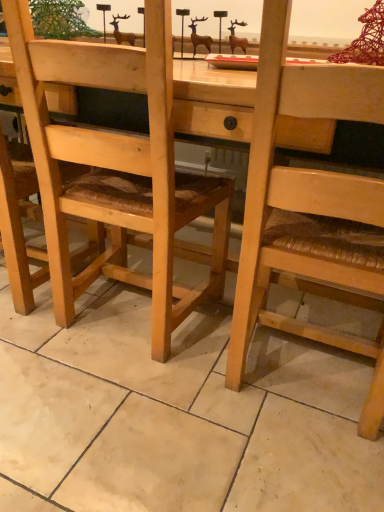
Describe the element at coordinates (308, 206) in the screenshot. The height and width of the screenshot is (512, 384). I see `natural wood chair at center, which is the first chair in right-to-left order` at that location.

Find the location of a particular element. natural wood chair at center, which is the second chair from left to right is located at coordinates (308, 206).

What do you see at coordinates (19, 227) in the screenshot? The image size is (384, 512). I see `wooden woven seat at center, placed as the second chair when sorted from right to left` at bounding box center [19, 227].

In the scene shown: What is the approximate height of wooden woven seat at center, placed as the second chair when sorted from right to left?

The height of wooden woven seat at center, placed as the second chair when sorted from right to left, is 36.45 inches.

Locate an element on the screen. The image size is (384, 512). wooden woven seat at center, which is the first chair from left to right is located at coordinates (19, 227).

The height and width of the screenshot is (512, 384). What are the coordinates of `natural wood chair at center, which is the first chair in right-to-left order` in the screenshot? It's located at (308, 206).

In the scene shown: Based on their positions, is wooden woven seat at center, placed as the second chair when sorted from right to left, located to the left or right of natural wood chair at center, which is the first chair in right-to-left order?

Clearly, wooden woven seat at center, placed as the second chair when sorted from right to left, is on the left of natural wood chair at center, which is the first chair in right-to-left order, in the image.

Is wooden woven seat at center, placed as the second chair when sorted from right to left, in front of natural wood chair at center, which is the second chair from left to right?

No, it is not.

Is point (92, 237) closer or farther from the camera than point (356, 211)?

Clearly, point (92, 237) is more distant from the camera than point (356, 211).

Looking at this image, from the image's perspective, which one is positioned higher, wooden woven seat at center, placed as the second chair when sorted from right to left, or natural wood chair at center, which is the first chair in right-to-left order?

From the image's view, wooden woven seat at center, placed as the second chair when sorted from right to left, is above.

From a real-world perspective, which is physically below, wooden woven seat at center, placed as the second chair when sorted from right to left, or natural wood chair at center, which is the first chair in right-to-left order?

In real-world perspective, wooden woven seat at center, placed as the second chair when sorted from right to left, is lower.

Is wooden woven seat at center, placed as the second chair when sorted from right to left, wider than natural wood chair at center, which is the second chair from left to right?

No, wooden woven seat at center, placed as the second chair when sorted from right to left, is not wider than natural wood chair at center, which is the second chair from left to right.

Considering the sizes of wooden woven seat at center, which is the first chair from left to right, and natural wood chair at center, which is the second chair from left to right, in the image, is wooden woven seat at center, which is the first chair from left to right, taller or shorter than natural wood chair at center, which is the second chair from left to right,?

In the image, wooden woven seat at center, which is the first chair from left to right, appears to be shorter than natural wood chair at center, which is the second chair from left to right.

Who is smaller, wooden woven seat at center, placed as the second chair when sorted from right to left, or natural wood chair at center, which is the first chair in right-to-left order?

wooden woven seat at center, placed as the second chair when sorted from right to left.

Consider the image. Would you say wooden woven seat at center, placed as the second chair when sorted from right to left, is outside natural wood chair at center, which is the second chair from left to right?

Yes, wooden woven seat at center, placed as the second chair when sorted from right to left, is not within natural wood chair at center, which is the second chair from left to right.

Are wooden woven seat at center, placed as the second chair when sorted from right to left, and natural wood chair at center, which is the first chair in right-to-left order, beside each other?

wooden woven seat at center, placed as the second chair when sorted from right to left, and natural wood chair at center, which is the first chair in right-to-left order, are not in contact.

Could you tell me if wooden woven seat at center, which is the first chair from left to right, is facing natural wood chair at center, which is the first chair in right-to-left order?

No, wooden woven seat at center, which is the first chair from left to right, is not facing towards natural wood chair at center, which is the first chair in right-to-left order.

How different are the orientations of wooden woven seat at center, which is the first chair from left to right, and natural wood chair at center, which is the first chair in right-to-left order, in degrees?

wooden woven seat at center, which is the first chair from left to right, and natural wood chair at center, which is the first chair in right-to-left order, are facing 3.92 degrees away from each other.

What are the coordinates of `chair located in front of the wooden woven seat at center, placed as the second chair when sorted from right to left` in the screenshot? It's located at (308, 206).

Can you confirm if natural wood chair at center, which is the first chair in right-to-left order, is positioned to the right of wooden woven seat at center, which is the first chair from left to right?

Yes, natural wood chair at center, which is the first chair in right-to-left order, is to the right of wooden woven seat at center, which is the first chair from left to right.

Is natural wood chair at center, which is the first chair in right-to-left order, further to the viewer compared to wooden woven seat at center, which is the first chair from left to right?

No.

Does point (382, 119) lie behind point (16, 284)?

No.

From the image's perspective, which is below, natural wood chair at center, which is the first chair in right-to-left order, or wooden woven seat at center, which is the first chair from left to right?

natural wood chair at center, which is the first chair in right-to-left order, is shown below in the image.

From a real-world perspective, is natural wood chair at center, which is the second chair from left to right, positioned above or below wooden woven seat at center, which is the first chair from left to right?

From a real-world perspective, natural wood chair at center, which is the second chair from left to right, is physically above wooden woven seat at center, which is the first chair from left to right.

Between natural wood chair at center, which is the first chair in right-to-left order, and wooden woven seat at center, placed as the second chair when sorted from right to left, which one has larger width?

With larger width is natural wood chair at center, which is the first chair in right-to-left order.

Between natural wood chair at center, which is the first chair in right-to-left order, and wooden woven seat at center, placed as the second chair when sorted from right to left, which one has less height?

With less height is wooden woven seat at center, placed as the second chair when sorted from right to left.

Does natural wood chair at center, which is the second chair from left to right, have a smaller size compared to wooden woven seat at center, placed as the second chair when sorted from right to left?

No, natural wood chair at center, which is the second chair from left to right, is not smaller than wooden woven seat at center, placed as the second chair when sorted from right to left.

Is wooden woven seat at center, which is the first chair from left to right, inside natural wood chair at center, which is the first chair in right-to-left order?

That's incorrect, wooden woven seat at center, which is the first chair from left to right, is not inside natural wood chair at center, which is the first chair in right-to-left order.

Is natural wood chair at center, which is the first chair in right-to-left order, beside wooden woven seat at center, placed as the second chair when sorted from right to left?

natural wood chair at center, which is the first chair in right-to-left order, is not next to wooden woven seat at center, placed as the second chair when sorted from right to left, and they're not touching.

Is natural wood chair at center, which is the first chair in right-to-left order, facing towards wooden woven seat at center, placed as the second chair when sorted from right to left?

No, natural wood chair at center, which is the first chair in right-to-left order, is not facing towards wooden woven seat at center, placed as the second chair when sorted from right to left.

Can you tell me how much natural wood chair at center, which is the first chair in right-to-left order, and wooden woven seat at center, which is the first chair from left to right, differ in facing direction?

The angle between the facing direction of natural wood chair at center, which is the first chair in right-to-left order, and the facing direction of wooden woven seat at center, which is the first chair from left to right, is 3.92 degrees.

How much distance is there between natural wood chair at center, which is the second chair from left to right, and wooden woven seat at center, which is the first chair from left to right?

29.75 inches.

Where is `chair behind the natural wood chair at center, which is the first chair in right-to-left order`? This screenshot has width=384, height=512. chair behind the natural wood chair at center, which is the first chair in right-to-left order is located at coordinates (19, 227).

Locate an element on the screen. chair on the right of wooden woven seat at center, placed as the second chair when sorted from right to left is located at coordinates (308, 206).

You are a GUI agent. You are given a task and a screenshot of the screen. Output one action in this format:
    pyautogui.click(x=<x>, y=<y>)
    Task: Click on the chair lying below the wooden woven seat at center, which is the first chair from left to right (from the image's perspective)
    This screenshot has width=384, height=512.
    Given the screenshot: What is the action you would take?
    pyautogui.click(x=308, y=206)